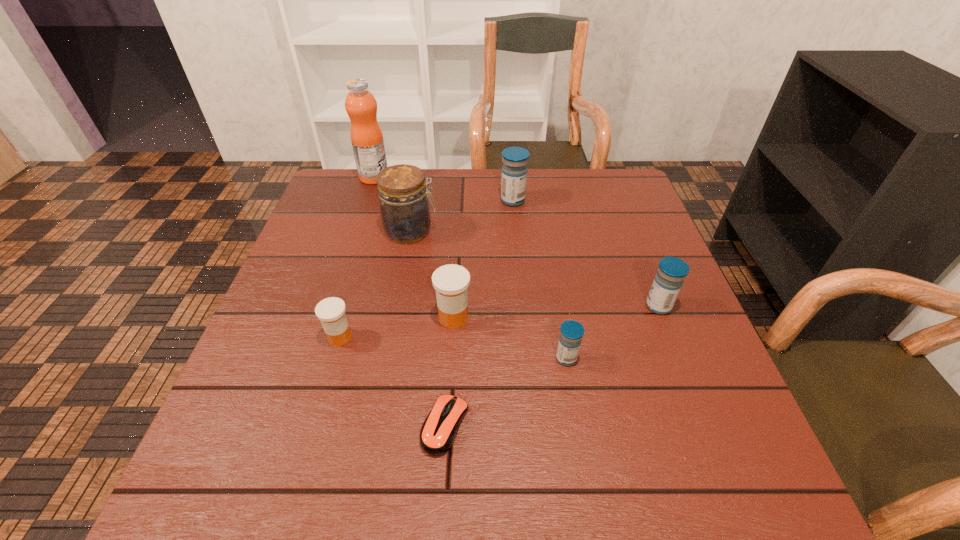
The image size is (960, 540). I want to click on object present at the far left corner, so 366,135.

Find the location of a particular element. The image size is (960, 540). free space at the far edge is located at coordinates (543, 191).

This screenshot has height=540, width=960. In the image, there is a desktop. Find the location of `vacant space at the near edge`. vacant space at the near edge is located at coordinates (529, 464).

I want to click on vacant space at the left edge of the desktop, so click(x=305, y=324).

You are a GUI agent. You are given a task and a screenshot of the screen. Output one action in this format:
    pyautogui.click(x=<x>, y=<y>)
    Task: Click on the blank area at the right edge
    
    Given the screenshot: What is the action you would take?
    pyautogui.click(x=633, y=368)

The width and height of the screenshot is (960, 540). In the image, there is a desktop. What are the coordinates of `vacant space at the far left corner` in the screenshot? It's located at (339, 170).

Locate an element on the screen. The image size is (960, 540). free space between the bigger orange medicine and the computer mouse is located at coordinates pyautogui.click(x=449, y=372).

You are a GUI agent. You are given a task and a screenshot of the screen. Output one action in this format:
    pyautogui.click(x=<x>, y=<y>)
    Task: Click on the vacant space in between the sixth object from left to right and the smaller orange medicine
    The width and height of the screenshot is (960, 540).
    Given the screenshot: What is the action you would take?
    pyautogui.click(x=426, y=269)

You are a GUI agent. You are given a task and a screenshot of the screen. Output one action in this format:
    pyautogui.click(x=<x>, y=<y>)
    Task: Click on the empty space between the nearest medicine and the rightmost medicine
    The width and height of the screenshot is (960, 540).
    Given the screenshot: What is the action you would take?
    pyautogui.click(x=612, y=332)

I want to click on empty location between the smallest blue medicine and the rightmost medicine, so (612, 332).